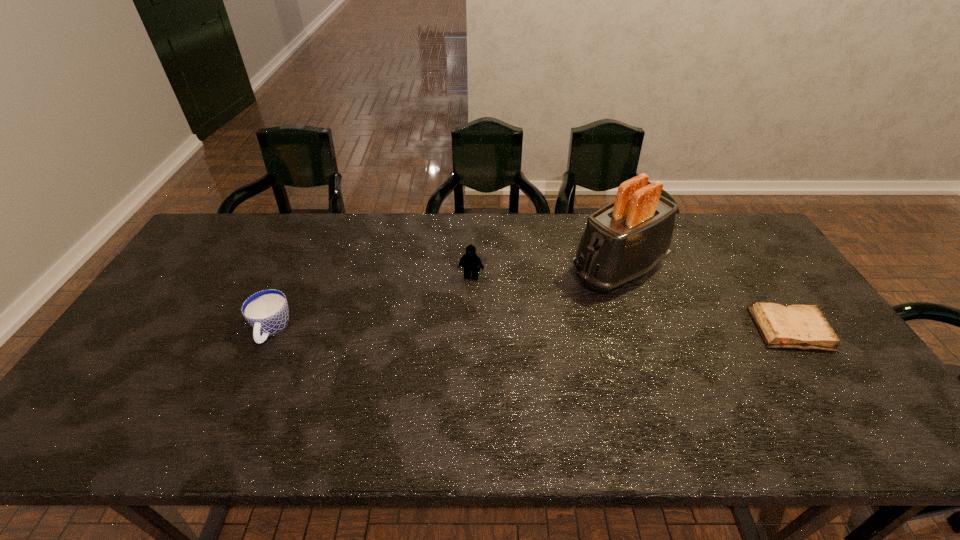
The width and height of the screenshot is (960, 540). In order to click on blank area at the left edge in this screenshot , I will do `click(155, 358)`.

Find the location of a particular element. This screenshot has width=960, height=540. free space at the far left corner of the desktop is located at coordinates (241, 220).

Where is `vacant space that's between the shortest object and the cup`? Image resolution: width=960 pixels, height=540 pixels. vacant space that's between the shortest object and the cup is located at coordinates (531, 330).

At what (x,y) coordinates should I click in order to perform the action: click on free space that is in between the toaster and the rightmost object. Please return your answer as a coordinate pair (x, y). Looking at the image, I should click on (704, 299).

Identify the location of empty space between the second tallest object and the toaster. (544, 273).

This screenshot has height=540, width=960. Find the location of `free space between the third object from left to right and the Lego`. free space between the third object from left to right and the Lego is located at coordinates (544, 273).

Image resolution: width=960 pixels, height=540 pixels. Find the location of `blank region between the shortest object and the leftmost object`. blank region between the shortest object and the leftmost object is located at coordinates (531, 330).

Find the location of a particular element. Image resolution: width=960 pixels, height=540 pixels. free spot between the toaster and the diary is located at coordinates (704, 299).

Image resolution: width=960 pixels, height=540 pixels. In order to click on vacant area between the Lego and the third tallest object in this screenshot , I will do `click(372, 304)`.

In order to click on vacant space that's between the second tallest object and the rightmost object in this screenshot , I will do coord(631,303).